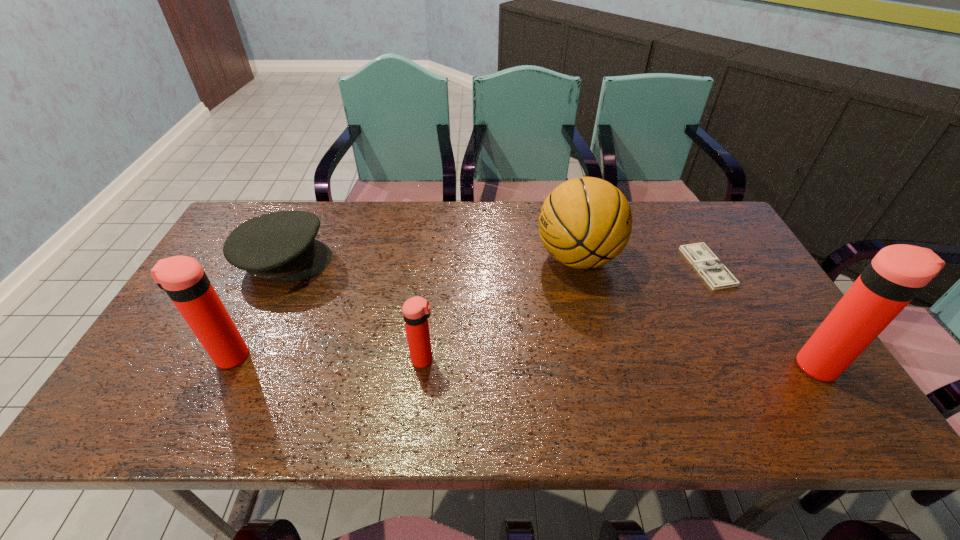
Image resolution: width=960 pixels, height=540 pixels. What are the coordinates of `thermos bottle that is positioned at the left edge` in the screenshot? It's located at (182, 277).

The image size is (960, 540). What are the coordinates of `beret that is at the left edge` in the screenshot? It's located at (281, 246).

You are a GUI agent. You are given a task and a screenshot of the screen. Output one action in this format:
    pyautogui.click(x=<x>, y=<y>)
    Task: Click on the thermos bottle at the right edge
    This screenshot has width=960, height=540.
    Given the screenshot: What is the action you would take?
    895,276

At what (x,y) coordinates should I click in order to perform the action: click on dollar positioned at the right edge. Please return your answer as a coordinate pair (x, y). The image size is (960, 540). Looking at the image, I should click on (713, 271).

You are a GUI agent. You are given a task and a screenshot of the screen. Output one action in this format:
    pyautogui.click(x=<x>, y=<y>)
    Task: Click on the object that is at the far left corner
    The height and width of the screenshot is (540, 960).
    Given the screenshot: What is the action you would take?
    pyautogui.click(x=281, y=246)

Where is `object positioned at the near left corner`? The height and width of the screenshot is (540, 960). object positioned at the near left corner is located at coordinates point(182,277).

This screenshot has height=540, width=960. I want to click on object situated at the far right corner, so click(x=713, y=271).

You are a GUI agent. You are given a task and a screenshot of the screen. Output one action in this format:
    pyautogui.click(x=<x>, y=<y>)
    Task: Click on the object positioned at the near right corner
    
    Given the screenshot: What is the action you would take?
    pyautogui.click(x=895, y=276)

The height and width of the screenshot is (540, 960). Find the location of `vacant space at the far edge of the desktop`. vacant space at the far edge of the desktop is located at coordinates (651, 238).

Where is `free spot at the near edge of the desktop`? The image size is (960, 540). free spot at the near edge of the desktop is located at coordinates (742, 386).